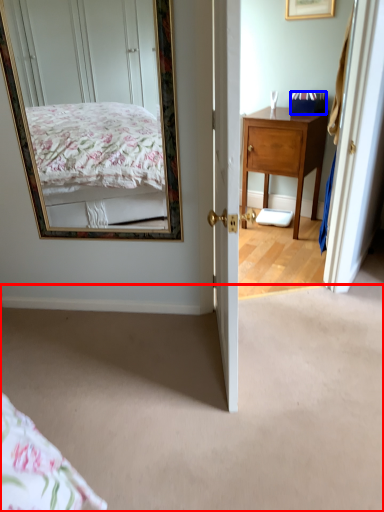
Question: Which object is closer to the camera taking this photo, plain (highlighted by a red box) or box (highlighted by a blue box)?

Choices:
 (A) plain
 (B) box

Answer: (A)